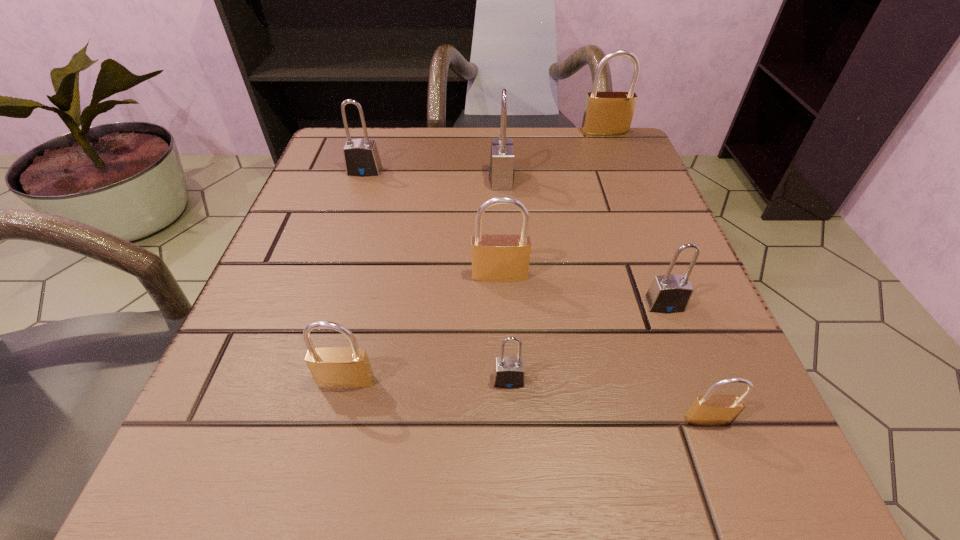
At what (x,y) coordinates should I click in order to perform the action: click on vacant space at the far right corner of the desktop. Please return your answer as a coordinate pair (x, y). Looking at the image, I should click on (619, 157).

Identify the location of vacant region between the smallest gray padlock and the rightmost gray padlock. (587, 342).

Identify the location of free spot between the smallest brass padlock and the smallest gray padlock. This screenshot has width=960, height=540. (609, 400).

In order to click on free space between the leftmost gray padlock and the biggest gray padlock in this screenshot , I will do (433, 175).

The width and height of the screenshot is (960, 540). In order to click on empty location between the farthest brass padlock and the leftmost gray padlock in this screenshot , I will do `click(485, 152)`.

This screenshot has height=540, width=960. I want to click on free spot between the third smallest brass padlock and the biggest gray padlock, so click(500, 227).

This screenshot has height=540, width=960. What are the coordinates of `free area in between the third farthest brass padlock and the biggest gray padlock` in the screenshot? It's located at (423, 280).

What are the coordinates of `vacant region between the fifth nearest object and the second biggest gray padlock` in the screenshot? It's located at (432, 223).

Locate an element on the screen. The height and width of the screenshot is (540, 960). empty space between the smallest gray padlock and the leftmost brass padlock is located at coordinates (427, 381).

The width and height of the screenshot is (960, 540). Find the location of `object that can be found as the fifth closest to the farthest padlock`. object that can be found as the fifth closest to the farthest padlock is located at coordinates (508, 372).